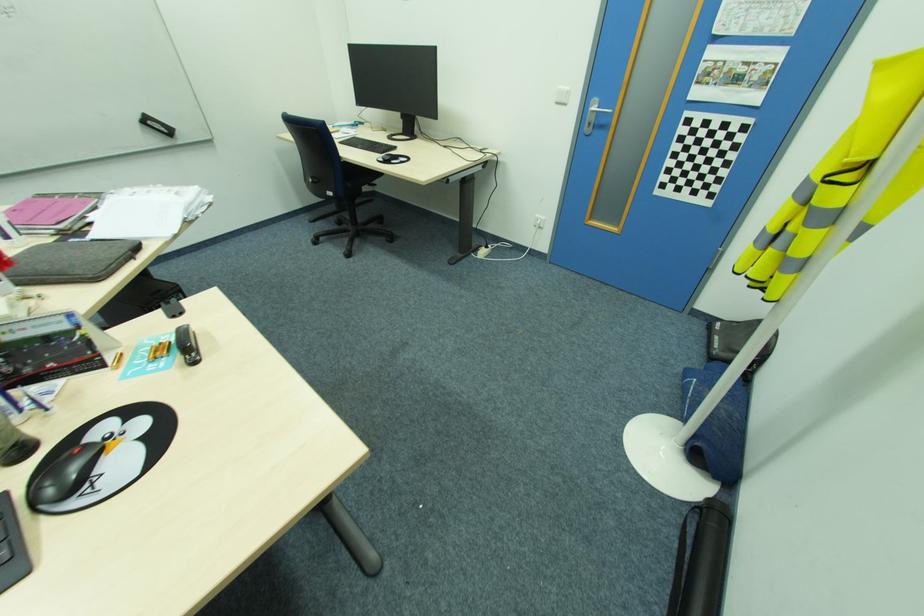
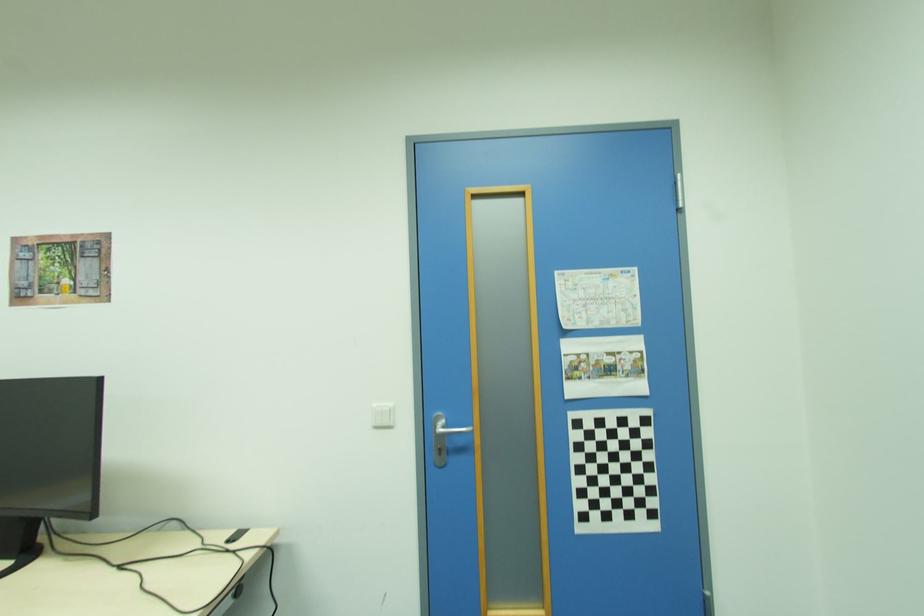
Where in the second image is the point corresponding to pixel 711 74 from the first image?

(579, 369)